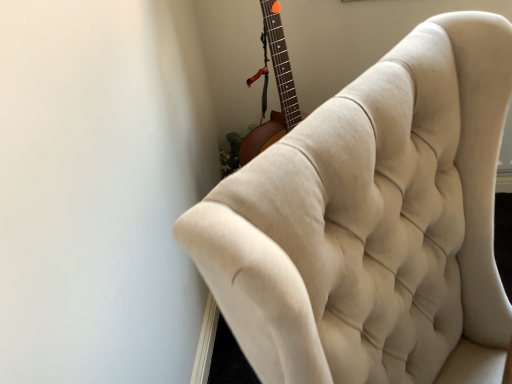
Based on the photo, measure the distance between point (309, 327) and camera.

The distance of point (309, 327) from camera is 12.32 inches.

This screenshot has width=512, height=384. What do you see at coordinates (373, 223) in the screenshot?
I see `beige fabric chair at upper right` at bounding box center [373, 223].

Locate an element on the screen. beige fabric chair at upper right is located at coordinates (373, 223).

Find the location of a particular element. The height and width of the screenshot is (384, 512). beige fabric chair at upper right is located at coordinates (373, 223).